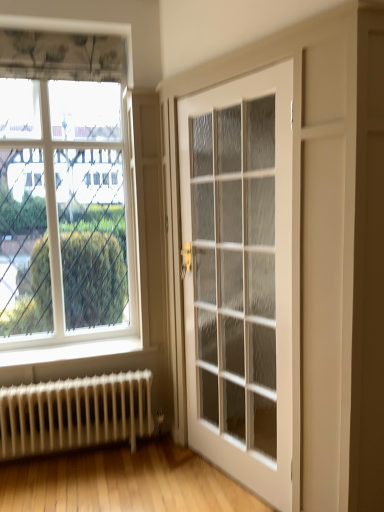
Where is `vacant space that is in between white glossy door at center and white metal radiator at lower left`? Image resolution: width=384 pixels, height=512 pixels. vacant space that is in between white glossy door at center and white metal radiator at lower left is located at coordinates (136, 479).